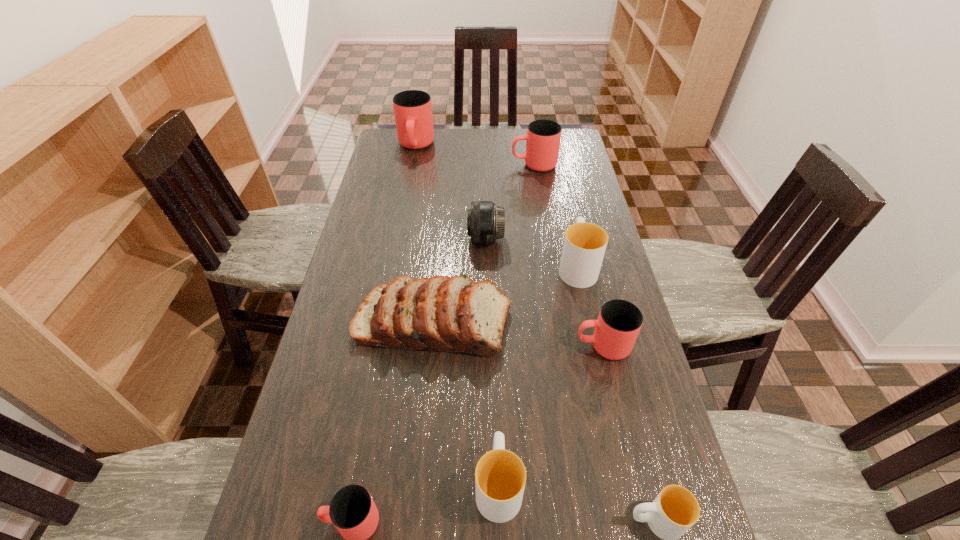
I want to click on the third cup from left to right, so click(x=500, y=476).

The width and height of the screenshot is (960, 540). Identify the location of free space located on the handle side of the biggest pink cup. (404, 207).

Where is `free location located 0.230m on the handle side of the second biggest pink cup`? Image resolution: width=960 pixels, height=540 pixels. free location located 0.230m on the handle side of the second biggest pink cup is located at coordinates (452, 165).

Identify the location of vacant space located 0.330m on the handle side of the second biggest pink cup. This screenshot has height=540, width=960. (427, 165).

Where is `vacant space positioned 0.320m on the handle side of the second biggest pink cup`? vacant space positioned 0.320m on the handle side of the second biggest pink cup is located at coordinates (430, 165).

In order to click on free space located 0.230m with the handle on the side of the farthest yellow cup in this screenshot , I will do `click(564, 203)`.

Locate an element on the screen. The image size is (960, 540). vacant space located with the handle on the side of the farthest yellow cup is located at coordinates (565, 215).

What are the coordinates of `vacant space located 0.070m with the handle on the side of the farthest yellow cup` in the screenshot? It's located at (569, 232).

This screenshot has width=960, height=540. I want to click on free point located 0.150m on the front-facing side of the telephoto lens, so click(421, 239).

Identify the location of vacant space located 0.140m on the front-facing side of the telephoto lens. click(x=425, y=239).